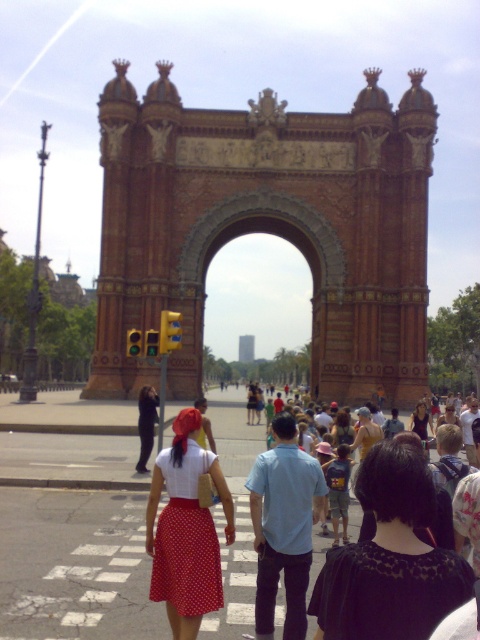
You are a photographer standing at the pedestrian crossing. You want to take a photo of both the black lace dress at center and the red fabric skirt at center so that both are clearly visible. Which of the two should you focus on first to ensure the other remains in the background?

You should focus on the black lace dress at center first because it is in front of the red fabric skirt at center, ensuring the latter stays in the background.

You are standing at the point marked by coordinates (145, 424) in the image. What is the color of the clothing item you are standing on?

The point at (145, 424) is on dark blue jeans at center, so the clothing item you are standing on is dark blue.